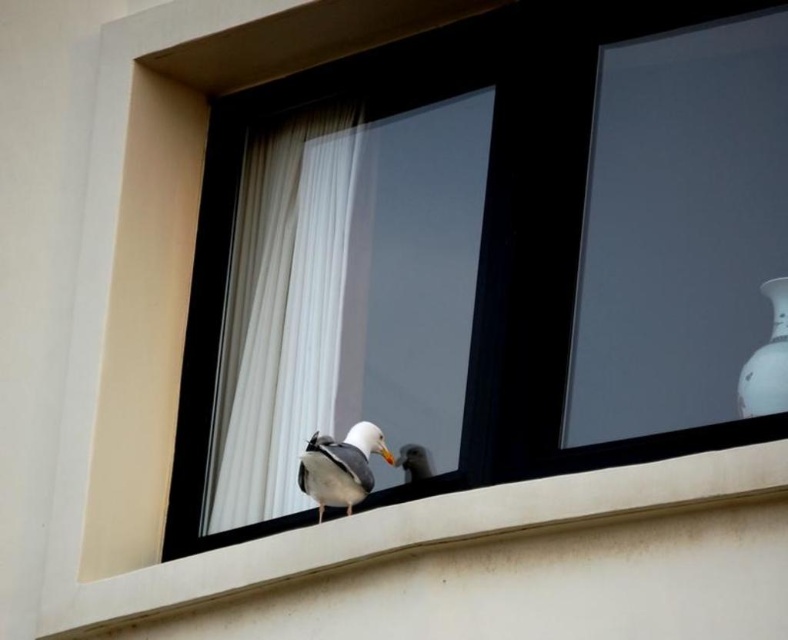
You are a delivery robot that needs to place a package on the white smooth concrete at center without disturbing the white feathered bird at center. What is the minimum distance you should maintain between the package and the bird to ensure safety?

The white smooth concrete at center and white feathered bird at center are 2.96 meters apart from each other. To ensure safety, the package should be placed at least 2.96 meters away from the bird.

Consider the image. You are a delivery person trying to place a package on the white porcelain vase at upper right. You are currently standing next to the matte glass window at center. Can you reach the vase without moving your position?

The distance between the matte glass window at center and the white porcelain vase at upper right is 15.86 feet. Since this distance is quite large, you would not be able to reach the vase without moving from your current position next to the matte glass window at center.